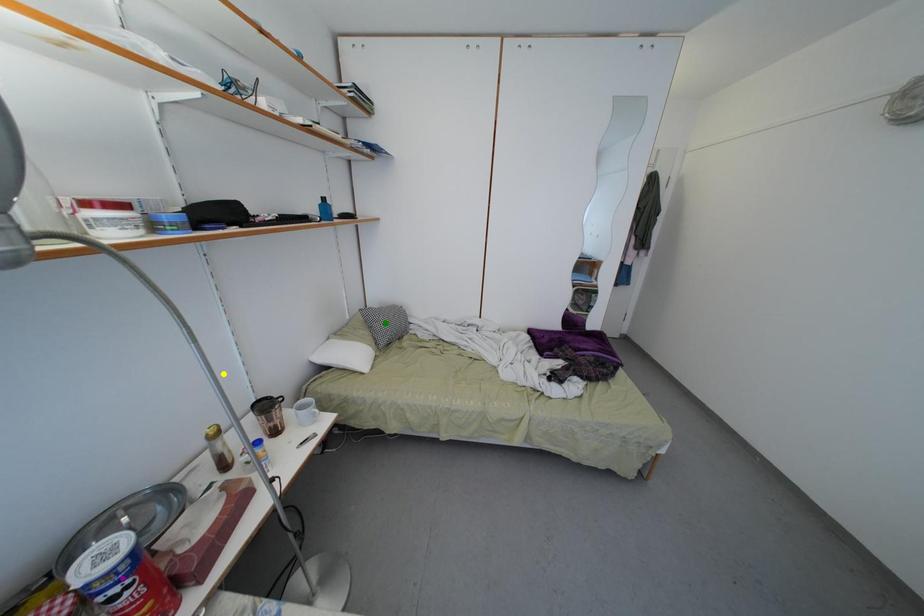
Order these from nearest to farthest:
A) yellow point
B) green point
C) purple point

purple point
yellow point
green point